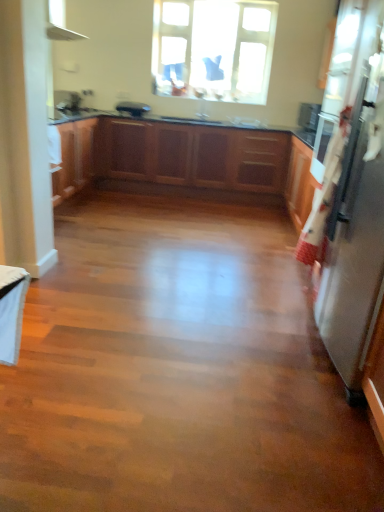
Question: In terms of height, does white glossy sink at center look taller or shorter compared to transparent glass window at upper center?

Choices:
 (A) tall
 (B) short

Answer: (B)

Question: Considering the relative positions of white glossy sink at center and transparent glass window at upper center in the image provided, is white glossy sink at center to the left or to the right of transparent glass window at upper center?

Choices:
 (A) right
 (B) left

Answer: (A)

Question: Which object is the closest to the satin black toaster at center, which is the 1th appliance in left-to-right order?

Choices:
 (A) white glossy sink at center
 (B) wooden cabinets at center
 (C) satin silver refrigerator at right, acting as the second appliance starting from the left
 (D) transparent glass window at upper center

Answer: (D)

Question: Based on their relative distances, which object is farther from the white glossy sink at center?

Choices:
 (A) satin silver refrigerator at right, arranged as the first appliance when ordered from the bottom
 (B) satin black toaster at center, the 2th appliance when ordered from bottom to top
 (C) wooden cabinets at center
 (D) transparent glass window at upper center

Answer: (A)